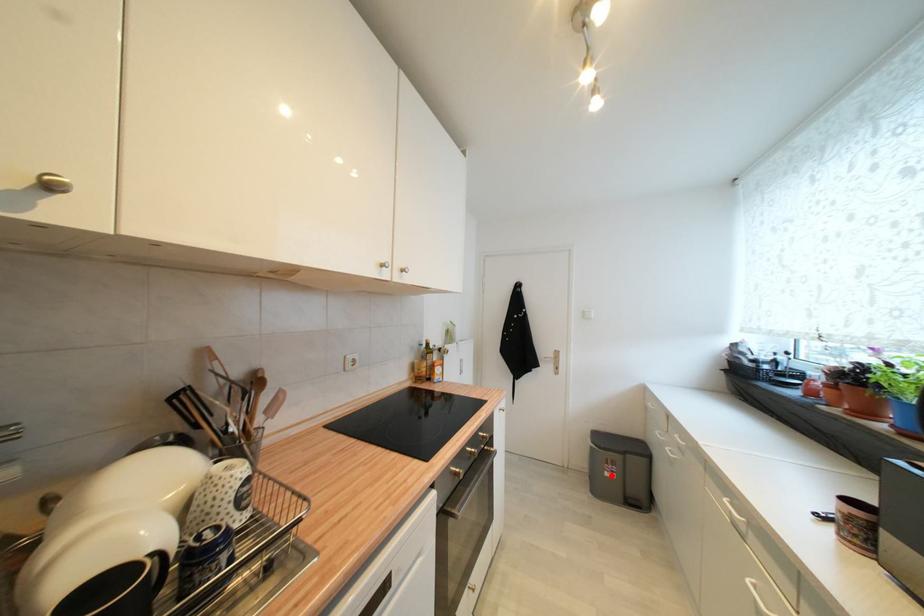
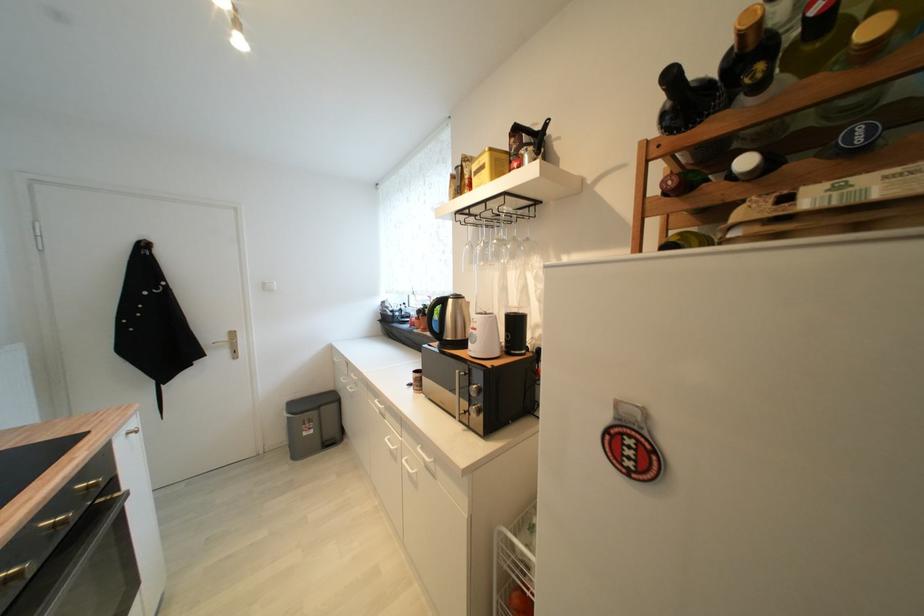
In the second image, find the point that corresponds to the highlighted location in the first image.

(310, 436)